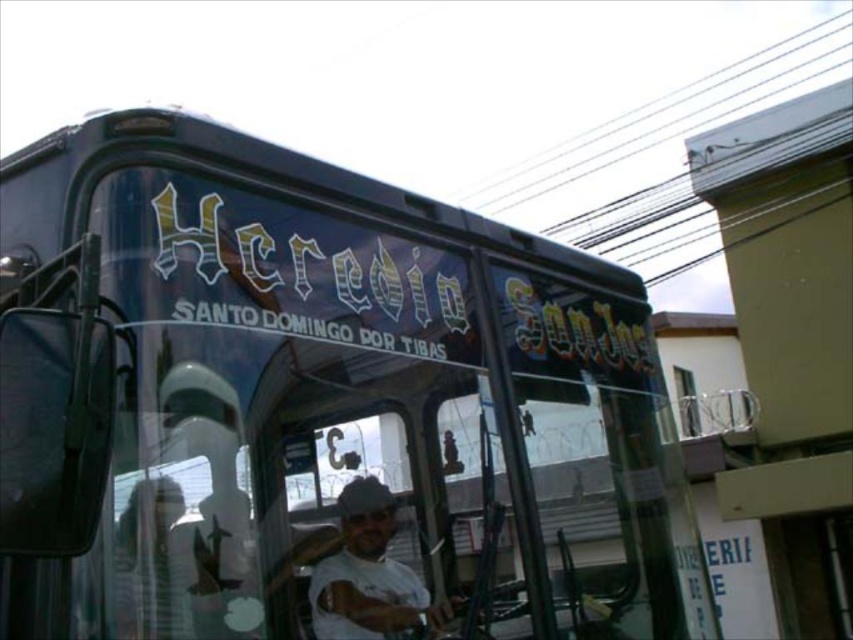
Question: Does shiny dark green bus at center have a lesser width compared to white matte shirt at center?

Choices:
 (A) yes
 (B) no

Answer: (B)

Question: Which point is farther to the camera?

Choices:
 (A) (335, 605)
 (B) (485, 492)

Answer: (B)

Question: Which object appears farthest from the camera in this image?

Choices:
 (A) white matte shirt at center
 (B) shiny dark green bus at center

Answer: (A)

Question: Which object appears closest to the camera in this image?

Choices:
 (A) white matte shirt at center
 (B) shiny dark green bus at center

Answer: (B)

Question: Considering the relative positions of shiny dark green bus at center and white matte shirt at center in the image provided, where is shiny dark green bus at center located with respect to white matte shirt at center?

Choices:
 (A) left
 (B) right

Answer: (B)

Question: Is shiny dark green bus at center wider than white matte shirt at center?

Choices:
 (A) yes
 (B) no

Answer: (A)